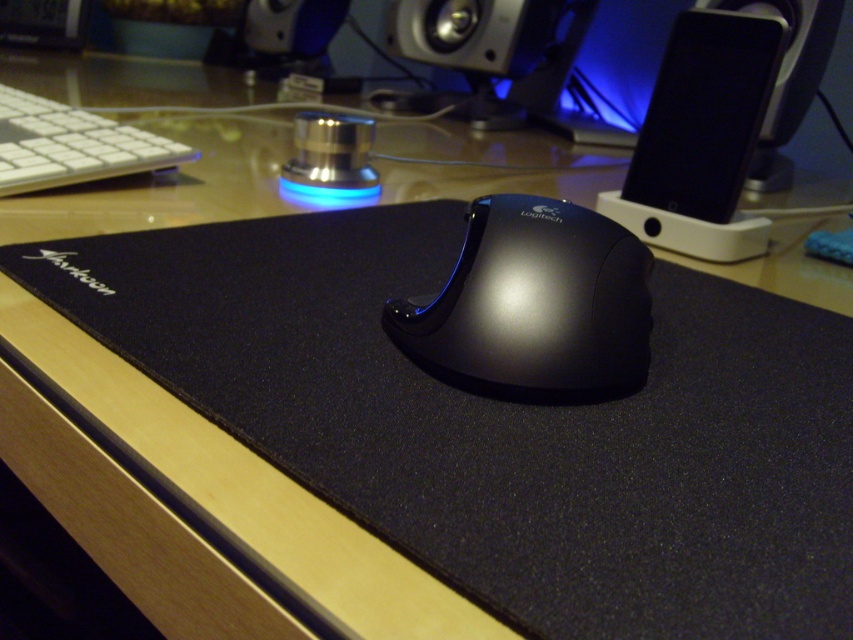
Is black glossy mouse at center taller than black plastic speaker at upper center?

Incorrect, black glossy mouse at center's height is not larger of black plastic speaker at upper center's.

Does point (573, 337) come behind point (788, 164)?

No, (573, 337) is in front of (788, 164).

Who is more distant from viewer, (x=624, y=371) or (x=791, y=44)?

The point (x=791, y=44) is behind.

You are a GUI agent. You are given a task and a screenshot of the screen. Output one action in this format:
    pyautogui.click(x=<x>, y=<y>)
    Task: Click on the black glossy mouse at center
    
    Given the screenshot: What is the action you would take?
    pyautogui.click(x=534, y=305)

In the scene shown: Which of these two, black plastic speaker at upper center or metallic silver speaker at upper center, stands taller?

black plastic speaker at upper center is taller.

Is black plastic speaker at upper center to the right of metallic silver speaker at upper center from the viewer's perspective?

Yes, black plastic speaker at upper center is to the right of metallic silver speaker at upper center.

Measure the distance between black plastic speaker at upper center and camera.

They are 3.29 feet apart.

At what (x,y) coordinates should I click in order to perform the action: click on black plastic speaker at upper center. Please return your answer as a coordinate pair (x, y). Looking at the image, I should click on [787, 77].

Is black glossy speaker at upper right closer to camera compared to metallic silver speaker at upper center?

Yes, it is.

Does black glossy speaker at upper right have a smaller size compared to metallic silver speaker at upper center?

Indeed, black glossy speaker at upper right has a smaller size compared to metallic silver speaker at upper center.

Which is behind, point (694, 109) or point (459, 52)?

Positioned behind is point (459, 52).

This screenshot has width=853, height=640. Find the location of `black glossy speaker at upper right`. black glossy speaker at upper right is located at coordinates (704, 113).